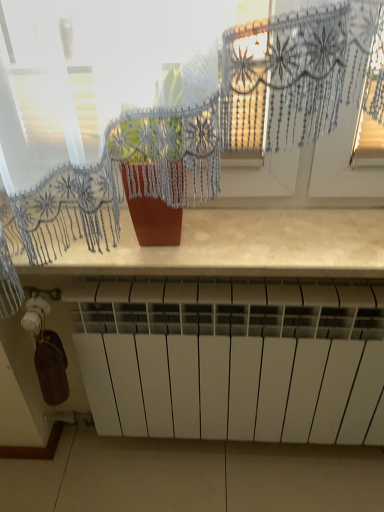
This screenshot has width=384, height=512. In order to click on vacant space situated above matte brown countertop at center (from a real-world perspective) in this screenshot , I will do `click(249, 232)`.